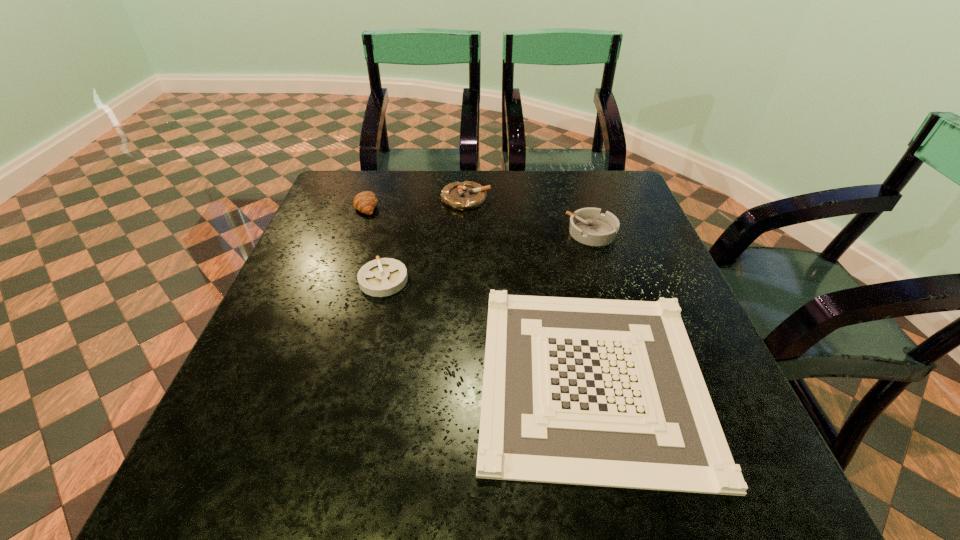
This screenshot has width=960, height=540. Identify the location of the leftmost object. (365, 202).

This screenshot has height=540, width=960. In order to click on the second nearest ashtray in this screenshot , I will do `click(589, 226)`.

Identify the location of the third nearest object. Image resolution: width=960 pixels, height=540 pixels. (589, 226).

This screenshot has width=960, height=540. Identify the location of the second ashtray from left to right. (467, 195).

Find the location of a particular element. the second object from left to right is located at coordinates (381, 277).

The height and width of the screenshot is (540, 960). In order to click on the fourth tallest object in this screenshot , I will do `click(381, 277)`.

At what (x,y) coordinates should I click in order to perform the action: click on the shortest object. Please return your answer as a coordinate pair (x, y). Image resolution: width=960 pixels, height=540 pixels. Looking at the image, I should click on (598, 392).

The image size is (960, 540). I want to click on vacant space positioned on the right of the leftmost object, so click(471, 205).

This screenshot has height=540, width=960. What are the coordinates of `vacant position located on the front of the second nearest ashtray` in the screenshot? It's located at (628, 348).

Identify the location of free region located on the right of the farthest ashtray. (547, 199).